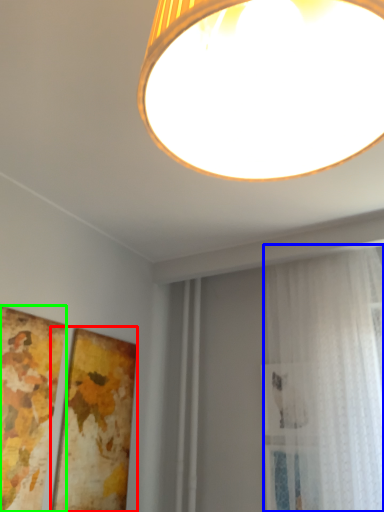
Question: Estimate the real-world distances between objects in this image. Which object is closer to picture frame (highlighted by a red box), curtain (highlighted by a blue box) or picture frame (highlighted by a green box)?

Choices:
 (A) curtain
 (B) picture frame

Answer: (B)